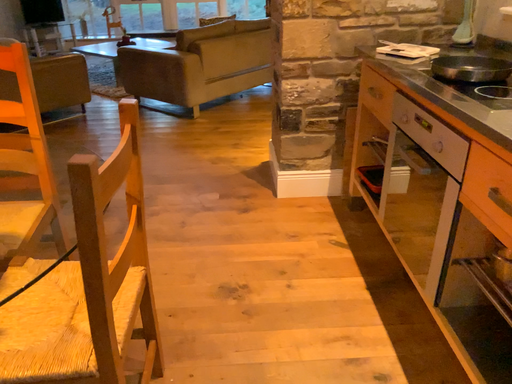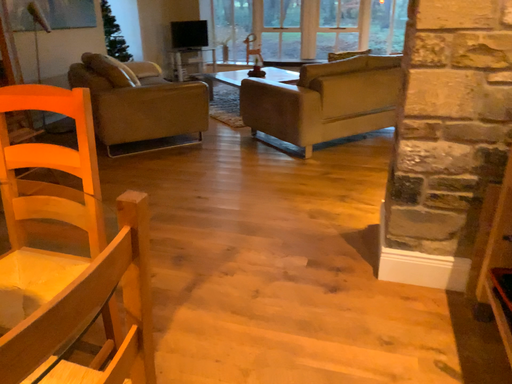
Question: How did the camera likely rotate when shooting the video?

Choices:
 (A) rotated right
 (B) rotated left

Answer: (B)